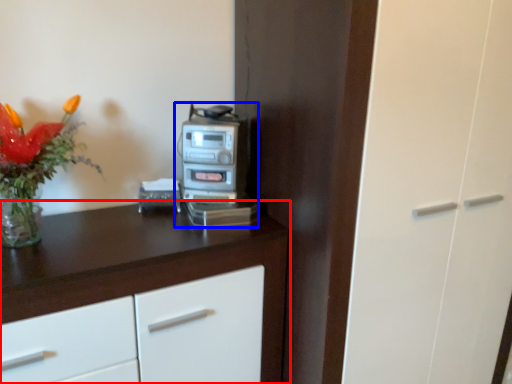
Question: Which point is closer to the camera, cabinetry (highlighted by a red box) or home appliance (highlighted by a blue box)?

Choices:
 (A) cabinetry
 (B) home appliance

Answer: (A)